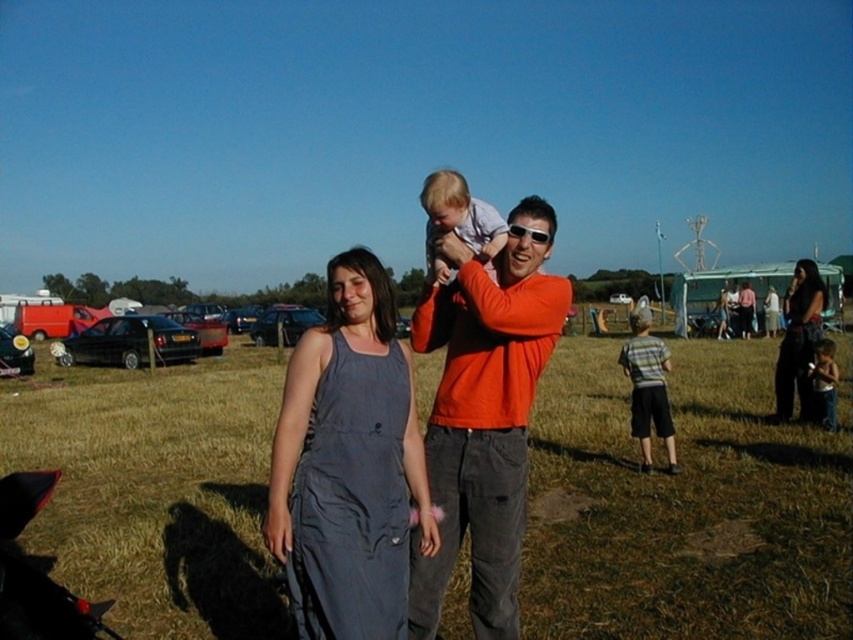
Is dark gray dress at right positioned before light blue fabric shirt at center?

That is False.

What are the coordinates of `dark gray dress at right` in the screenshot? It's located at coord(799,340).

Between point (793, 384) and point (428, 240), which one is positioned behind?

The point (793, 384) is more distant.

The height and width of the screenshot is (640, 853). I want to click on dark gray dress at right, so click(799, 340).

Is gray fabric dress at center below dark gray dress at right?

Yes, gray fabric dress at center is below dark gray dress at right.

Is point (340, 554) positioned in front of point (809, 413)?

Yes, it is in front of point (809, 413).

Between point (410, 435) and point (805, 276), which one is positioned behind?

Positioned behind is point (805, 276).

This screenshot has width=853, height=640. Identify the location of gray fabric dress at center. (347, 465).

Is point (662, 362) behind point (816, 403)?

No.

Can you confirm if striped cotton shirt at lower right is thinner than light brown fabric baby at lower right?

In fact, striped cotton shirt at lower right might be wider than light brown fabric baby at lower right.

Where is `striped cotton shirt at lower right`? This screenshot has width=853, height=640. striped cotton shirt at lower right is located at coordinates (648, 388).